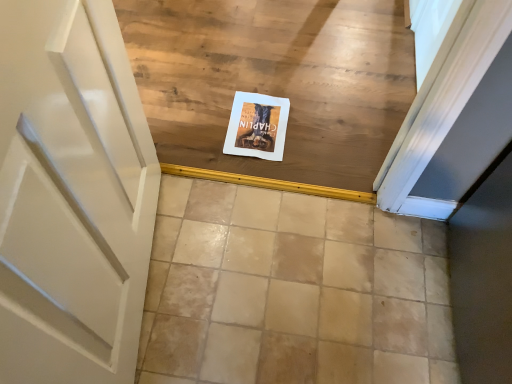
Find the location of `free location above white paper at center (from a real-world perspective)`. free location above white paper at center (from a real-world perspective) is located at coordinates (261, 121).